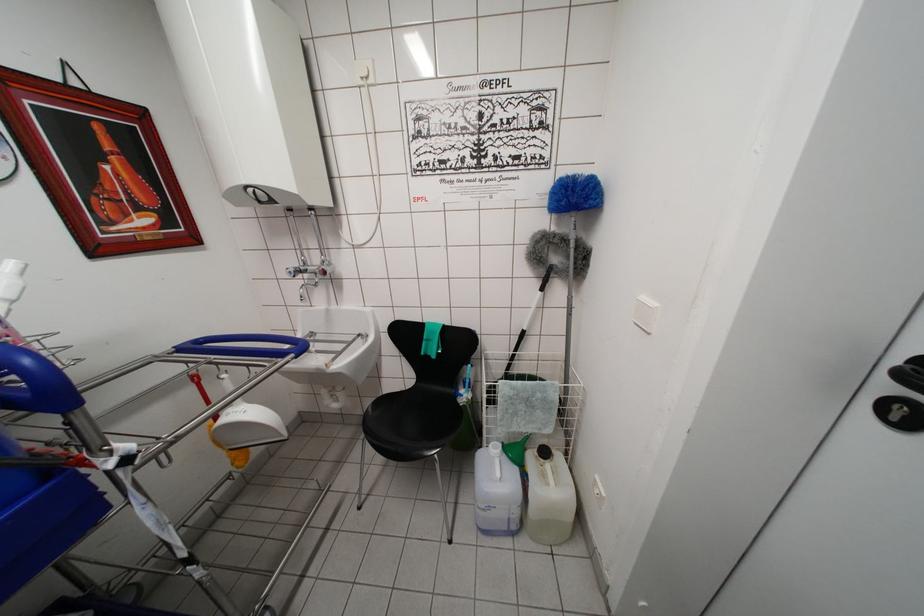
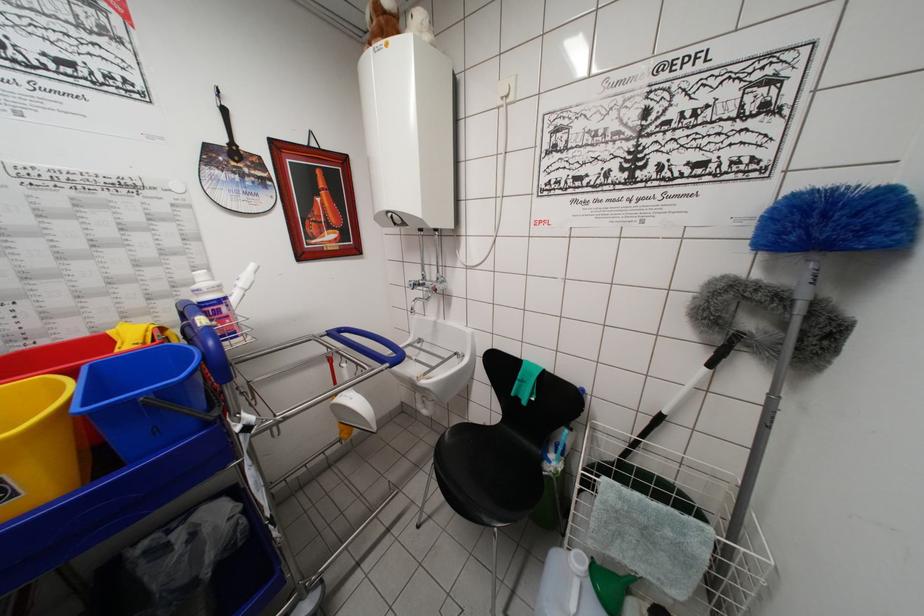
Question: The images are taken continuously from a first-person perspective. In which direction is your viewpoint rotating?

Choices:
 (A) Left
 (B) Right
 (C) Up
 (D) Down

Answer: (A)